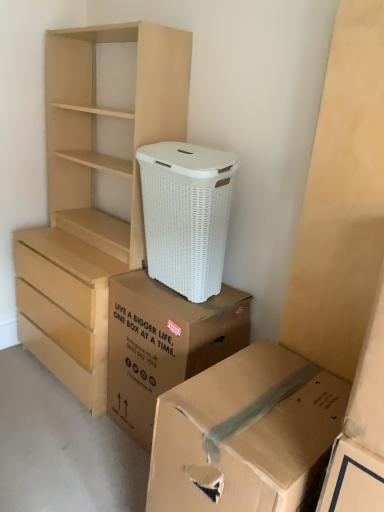
Where is `light brown wood chest of drawers at left`? light brown wood chest of drawers at left is located at coordinates (92, 198).

The height and width of the screenshot is (512, 384). Describe the element at coordinates (245, 434) in the screenshot. I see `cardboard box at lower right, the 1th box from the front` at that location.

Identify the location of brown cardboard box at lower center, which is the second box from front to back. Image resolution: width=384 pixels, height=512 pixels. (164, 344).

In terms of size, does light brown wood chest of drawers at left appear bigger or smaller than cardboard box at lower right, the 1th box from the front?

In the image, light brown wood chest of drawers at left appears to be larger than cardboard box at lower right, the 1th box from the front.

Is light brown wood chest of drawers at left further to the viewer compared to cardboard box at lower right, the 1th box from the front?

Yes, it is.

Which is closer, (182, 81) or (304, 400)?

Positioned in front is point (304, 400).

Does white wicker laundry basket at center have a larger size compared to brown cardboard box at lower center, which ranks as the first box in back-to-front order?

Actually, white wicker laundry basket at center might be smaller than brown cardboard box at lower center, which ranks as the first box in back-to-front order.

How different are the orientations of white wicker laundry basket at center and brown cardboard box at lower center, which ranks as the first box in back-to-front order, in degrees?

1.68 degrees separate the facing orientations of white wicker laundry basket at center and brown cardboard box at lower center, which ranks as the first box in back-to-front order.

Considering the relative sizes of white wicker laundry basket at center and brown cardboard box at lower center, which is the second box from front to back, in the image provided, is white wicker laundry basket at center shorter than brown cardboard box at lower center, which is the second box from front to back,?

Indeed, white wicker laundry basket at center has a lesser height compared to brown cardboard box at lower center, which is the second box from front to back.

From the image's perspective, between white wicker laundry basket at center and cardboard box at lower right, the 1th box from the front, which one is located above?

white wicker laundry basket at center, from the image's perspective.

From the picture: Considering the relative sizes of white wicker laundry basket at center and cardboard box at lower right, acting as the second box starting from the back, in the image provided, is white wicker laundry basket at center thinner than cardboard box at lower right, acting as the second box starting from the back,?

Correct, the width of white wicker laundry basket at center is less than that of cardboard box at lower right, acting as the second box starting from the back.

Does white wicker laundry basket at center have a larger size compared to cardboard box at lower right, the 1th box from the front?

Incorrect, white wicker laundry basket at center is not larger than cardboard box at lower right, the 1th box from the front.

Would you consider white wicker laundry basket at center to be distant from cardboard box at lower right, acting as the second box starting from the back?

white wicker laundry basket at center is actually quite close to cardboard box at lower right, acting as the second box starting from the back.

Does brown cardboard box at lower center, which ranks as the first box in back-to-front order, appear on the right side of white wicker laundry basket at center?

In fact, brown cardboard box at lower center, which ranks as the first box in back-to-front order, is to the left of white wicker laundry basket at center.

Considering the relative positions of brown cardboard box at lower center, which is the second box from front to back, and white wicker laundry basket at center in the image provided, is brown cardboard box at lower center, which is the second box from front to back, in front of white wicker laundry basket at center?

That is False.

Is brown cardboard box at lower center, which ranks as the first box in back-to-front order, bigger than white wicker laundry basket at center?

Correct, brown cardboard box at lower center, which ranks as the first box in back-to-front order, is larger in size than white wicker laundry basket at center.

Which is correct: brown cardboard box at lower center, which ranks as the first box in back-to-front order, is inside white wicker laundry basket at center, or outside of it?

brown cardboard box at lower center, which ranks as the first box in back-to-front order, exists outside the volume of white wicker laundry basket at center.

What are the coordinates of `chest of drawers behind the white wicker laundry basket at center` in the screenshot? It's located at (92, 198).

Who is taller, light brown wood chest of drawers at left or white wicker laundry basket at center?

Standing taller between the two is light brown wood chest of drawers at left.

Which of these two, light brown wood chest of drawers at left or white wicker laundry basket at center, is wider?

Wider between the two is light brown wood chest of drawers at left.

From the image's perspective, is cardboard box at lower right, acting as the second box starting from the back, located above or below brown cardboard box at lower center, which is the second box from front to back?

From the image's perspective, cardboard box at lower right, acting as the second box starting from the back, appears below brown cardboard box at lower center, which is the second box from front to back.

From a real-world perspective, is cardboard box at lower right, the 1th box from the front, physically located above or below brown cardboard box at lower center, which ranks as the first box in back-to-front order?

In terms of real-world spatial position, cardboard box at lower right, the 1th box from the front, is below brown cardboard box at lower center, which ranks as the first box in back-to-front order.

Is cardboard box at lower right, acting as the second box starting from the back, in contact with brown cardboard box at lower center, which is the second box from front to back?

No, cardboard box at lower right, acting as the second box starting from the back, is not in contact with brown cardboard box at lower center, which is the second box from front to back.

Does cardboard box at lower right, acting as the second box starting from the back, turn towards brown cardboard box at lower center, which is the second box from front to back?

No, cardboard box at lower right, acting as the second box starting from the back, is not turned towards brown cardboard box at lower center, which is the second box from front to back.

Is white wicker laundry basket at center at the back of cardboard box at lower right, acting as the second box starting from the back?

cardboard box at lower right, acting as the second box starting from the back, does not have its back to white wicker laundry basket at center.

Does cardboard box at lower right, the 1th box from the front, appear on the left side of white wicker laundry basket at center?

Incorrect, cardboard box at lower right, the 1th box from the front, is not on the left side of white wicker laundry basket at center.

In the scene shown: From a real-world perspective, which is physically above, cardboard box at lower right, the 1th box from the front, or white wicker laundry basket at center?

white wicker laundry basket at center.

Where is `chest of drawers on the left of cardboard box at lower right, the 1th box from the front`? chest of drawers on the left of cardboard box at lower right, the 1th box from the front is located at coordinates (92, 198).

Locate an element on the screen. The width and height of the screenshot is (384, 512). shoe box above the brown cardboard box at lower center, which ranks as the first box in back-to-front order (from a real-world perspective) is located at coordinates (186, 215).

Estimate the real-world distances between objects in this image. Which object is further from brown cardboard box at lower center, which is the second box from front to back, white wicker laundry basket at center or light brown wood chest of drawers at left?

Based on the image, light brown wood chest of drawers at left appears to be further to brown cardboard box at lower center, which is the second box from front to back.

From the image, which object appears to be farther from brown cardboard box at lower center, which is the second box from front to back, white wicker laundry basket at center or cardboard box at lower right, acting as the second box starting from the back?

cardboard box at lower right, acting as the second box starting from the back.

Which object lies further to the anchor point white wicker laundry basket at center, brown cardboard box at lower center, which ranks as the first box in back-to-front order, or cardboard box at lower right, the 1th box from the front?

Based on the image, cardboard box at lower right, the 1th box from the front, appears to be further to white wicker laundry basket at center.

When comparing their distances from light brown wood chest of drawers at left, does cardboard box at lower right, the 1th box from the front, or white wicker laundry basket at center seem closer?

white wicker laundry basket at center lies closer to light brown wood chest of drawers at left than the other object.

Estimate the real-world distances between objects in this image. Which object is further from cardboard box at lower right, the 1th box from the front, white wicker laundry basket at center or light brown wood chest of drawers at left?

light brown wood chest of drawers at left lies further to cardboard box at lower right, the 1th box from the front, than the other object.

Looking at the image, which one is located closer to white wicker laundry basket at center, light brown wood chest of drawers at left or brown cardboard box at lower center, which ranks as the first box in back-to-front order?

brown cardboard box at lower center, which ranks as the first box in back-to-front order, lies closer to white wicker laundry basket at center than the other object.

Estimate the real-world distances between objects in this image. Which object is further from light brown wood chest of drawers at left, brown cardboard box at lower center, which ranks as the first box in back-to-front order, or white wicker laundry basket at center?

The object further to light brown wood chest of drawers at left is brown cardboard box at lower center, which ranks as the first box in back-to-front order.

From the image, which object appears to be nearer to light brown wood chest of drawers at left, brown cardboard box at lower center, which is the second box from front to back, or cardboard box at lower right, acting as the second box starting from the back?

brown cardboard box at lower center, which is the second box from front to back, is closer to light brown wood chest of drawers at left.

This screenshot has height=512, width=384. In order to click on shoe box that lies between light brown wood chest of drawers at left and cardboard box at lower right, the 1th box from the front, from top to bottom in this screenshot , I will do `click(186, 215)`.

Locate an element on the screen. This screenshot has width=384, height=512. box between white wicker laundry basket at center and cardboard box at lower right, acting as the second box starting from the back, from top to bottom is located at coordinates (164, 344).

Locate an element on the screen. box between light brown wood chest of drawers at left and cardboard box at lower right, acting as the second box starting from the back, in the vertical direction is located at coordinates (x=164, y=344).

Locate an element on the screen. shoe box that lies between light brown wood chest of drawers at left and brown cardboard box at lower center, which ranks as the first box in back-to-front order, from top to bottom is located at coordinates (186, 215).